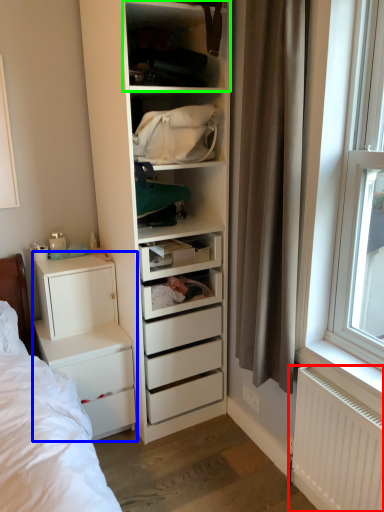
Question: Considering the real-world distances, which object is farthest from radiator (highlighted by a red box)? chest of drawers (highlighted by a blue box) or shelf (highlighted by a green box)?

Choices:
 (A) chest of drawers
 (B) shelf

Answer: (B)